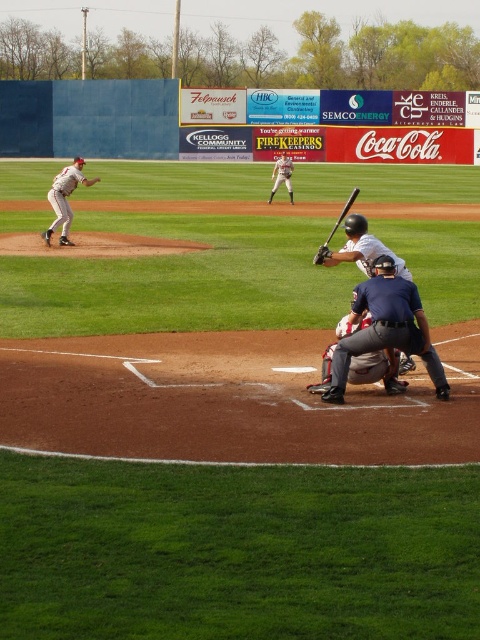
Which is above, black matte bat at center or brown leather glove at center?

brown leather glove at center

Does black matte bat at center appear under brown leather glove at center?

Correct, black matte bat at center is located below brown leather glove at center.

Which is in front, point (356, 189) or point (284, 173)?

Point (356, 189) is more forward.

The height and width of the screenshot is (640, 480). In order to click on black matte bat at center in this screenshot , I will do `click(335, 228)`.

Can you confirm if silver metallic baseball glove at upper center is bigger than brown leather glove at center?

Yes, silver metallic baseball glove at upper center is bigger than brown leather glove at center.

Can you confirm if silver metallic baseball glove at upper center is positioned to the right of brown leather glove at center?

No, silver metallic baseball glove at upper center is not to the right of brown leather glove at center.

Describe the element at coordinates (282, 176) in the screenshot. I see `silver metallic baseball glove at upper center` at that location.

This screenshot has width=480, height=640. I want to click on silver metallic baseball glove at upper center, so click(x=282, y=176).

Is dark blue uniform at center to the left of brown leather glove at center from the viewer's perspective?

No, dark blue uniform at center is not to the left of brown leather glove at center.

Is point (347, 358) closer to camera compared to point (286, 176)?

Yes, point (347, 358) is closer to viewer.

Is point (394, 388) farther from camera compared to point (287, 177)?

No.

At what (x,y) coordinates should I click in order to perform the action: click on dark blue uniform at center. Please return your answer as a coordinate pair (x, y). The width and height of the screenshot is (480, 640). Looking at the image, I should click on (385, 328).